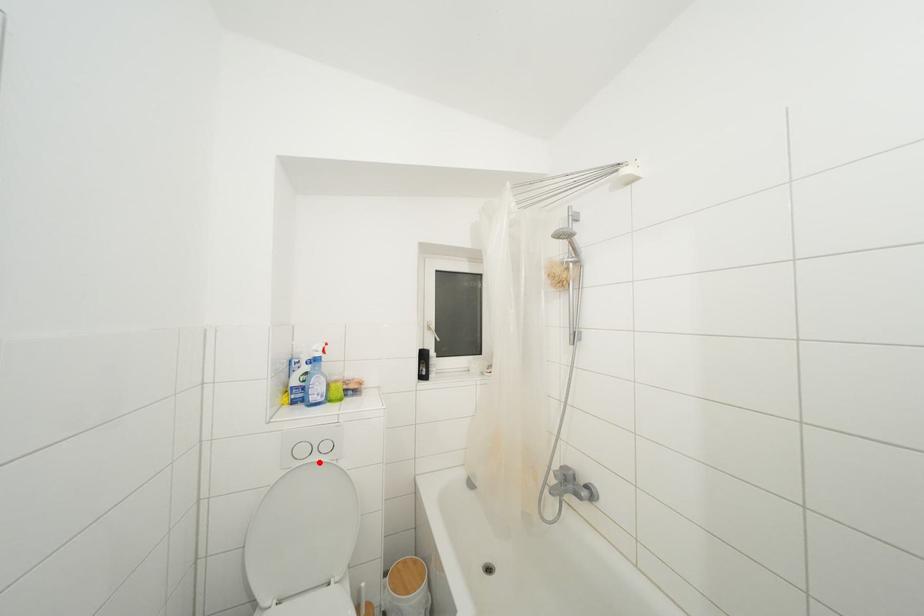
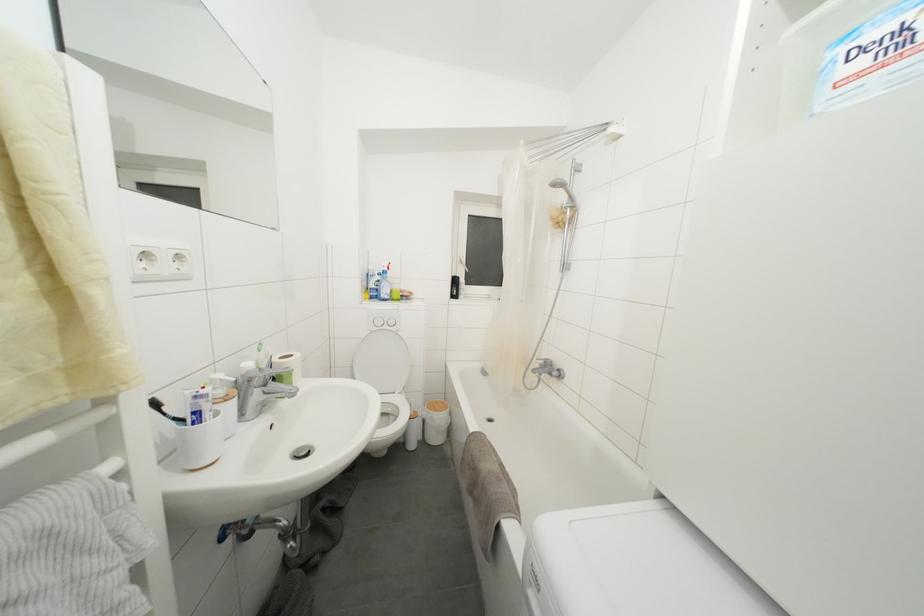
Where in the second image is the point corresponding to the highlighted location from the first image?

(390, 331)